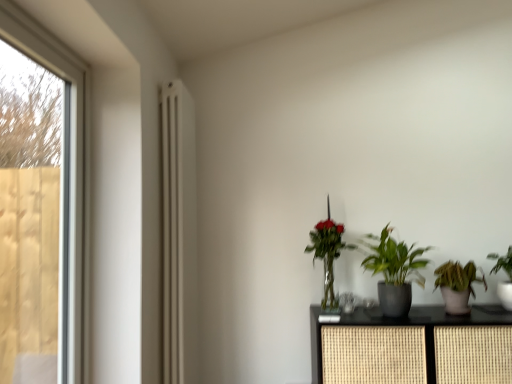
Question: Based on their sizes in the image, would you say green matte houseplant at lower right, which ranks as the 3th houseplant in left-to-right order, is bigger or smaller than matte white radiator at left?

Choices:
 (A) big
 (B) small

Answer: (B)

Question: Is point (456, 264) positioned closer to the camera than point (192, 258)?

Choices:
 (A) closer
 (B) farther

Answer: (A)

Question: Based on their relative distances, which object is farther from the green glossy plant at center, the first houseplant in the left-to-right sequence?

Choices:
 (A) transparent glass screen door at left
 (B) rattan cabinet at center
 (C) green leafy plant at right, the first houseplant when ordered from right to left
 (D) matte white radiator at left
 (E) green matte houseplant at lower right, positioned as the second houseplant in right-to-left order

Answer: (A)

Question: Which of these objects is positioned closest to the rattan cabinet at center?

Choices:
 (A) transparent glass screen door at left
 (B) matte white radiator at left
 (C) green glossy plant at center, which appears as the 4th houseplant when viewed from the right
 (D) green leafy plant at right, which is counted as the 4th houseplant, starting from the left
 (E) green matte houseplant at lower right, which ranks as the 3th houseplant in left-to-right order

Answer: (E)